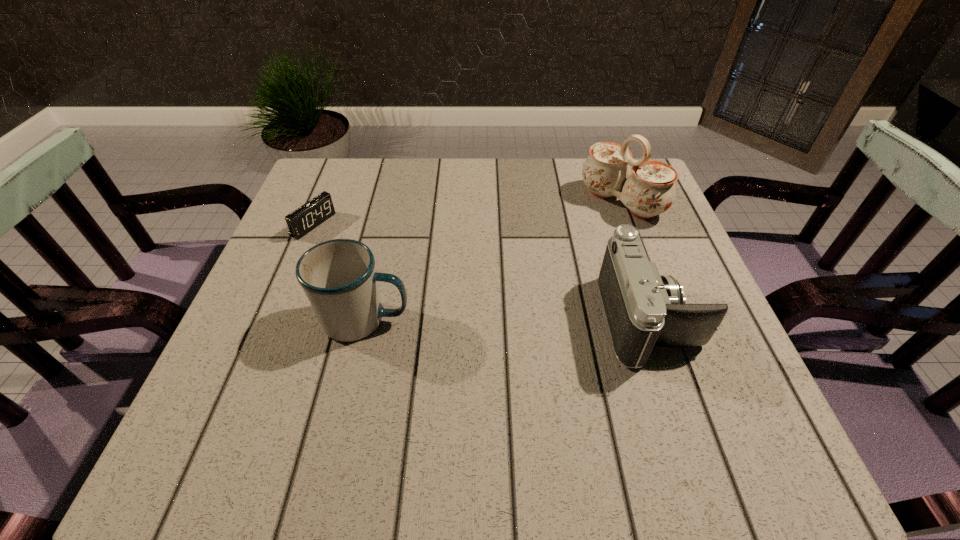
Find the location of a particular element. mug is located at coordinates pyautogui.click(x=338, y=276).

What are the coordinates of `camera` in the screenshot? It's located at (643, 309).

Identify the location of the shortest object. (307, 217).

Where is `the leftmost object`? This screenshot has width=960, height=540. the leftmost object is located at coordinates (307, 217).

Where is `chinaware`? chinaware is located at coordinates (650, 190).

At what (x,y) coordinates should I click in order to perform the action: click on free space located 0.080m on the handle side of the mug. Please return your answer as a coordinate pair (x, y). Image resolution: width=960 pixels, height=540 pixels. Looking at the image, I should click on (453, 320).

Identify the location of free point located 0.170m on the front-facing side of the alarm clock. The height and width of the screenshot is (540, 960). (380, 260).

Identify the location of vacant position located on the front-facing side of the alarm clock. (442, 291).

The image size is (960, 540). I want to click on blank space located 0.310m on the front-facing side of the alarm clock, so click(x=430, y=286).

Locate an element on the screen. The image size is (960, 540). vacant space located by the handle of the chinaware is located at coordinates (540, 264).